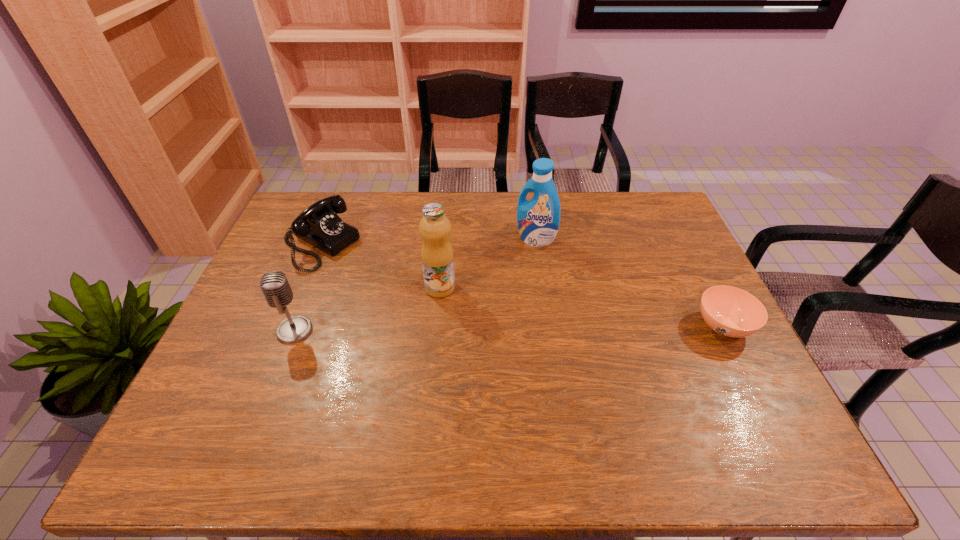
Point out which object is positioned as the nearest to the second shortest object. Please provide its 2D coordinates. Your answer should be formatted as a tuple, i.e. [(x, y)], where the tuple contains the x and y coordinates of a point satisfying the conditions above.

[(274, 285)]

Find the location of a particular element. The width and height of the screenshot is (960, 540). vacant position in the image that satisfies the following two spatial constraints: 1. on the front side of the soup bowl; 2. on the left side of the second shortest object is located at coordinates (287, 326).

The image size is (960, 540). I want to click on blank space that satisfies the following two spatial constraints: 1. on the front side of the third object from left to right; 2. on the right side of the telephone, so click(x=303, y=288).

Find the location of a particular element. free space that satisfies the following two spatial constraints: 1. on the front side of the third farthest object; 2. on the left side of the rightmost object is located at coordinates (437, 326).